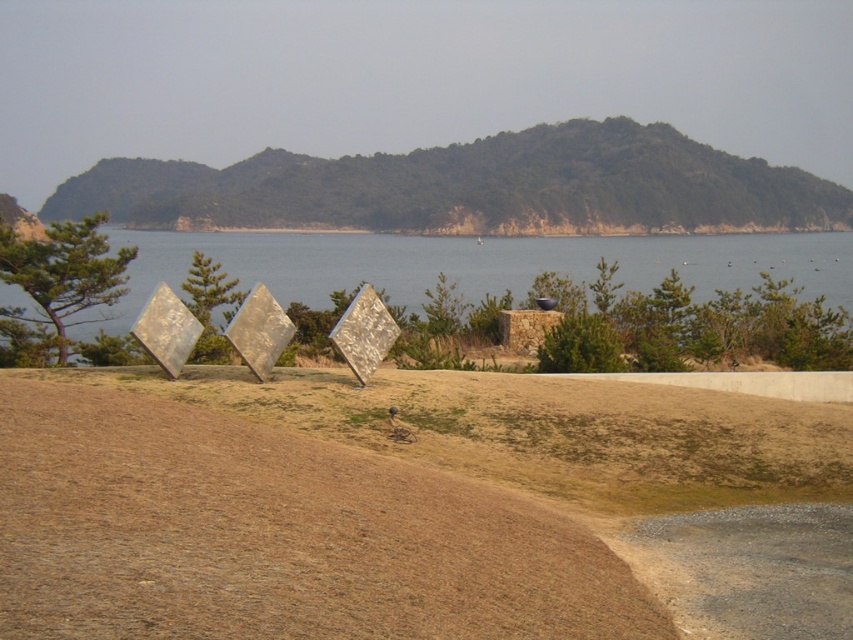
Question: Which point is farther from the camera taking this photo?

Choices:
 (A) (561, 179)
 (B) (311, 269)

Answer: (A)

Question: Which point is farther to the camera?

Choices:
 (A) green textured hillside at upper center
 (B) blue water at center

Answer: (A)

Question: Is green textured hillside at upper center bigger than blue water at center?

Choices:
 (A) yes
 (B) no

Answer: (B)

Question: Is green textured hillside at upper center closer to the viewer compared to blue water at center?

Choices:
 (A) yes
 (B) no

Answer: (B)

Question: Does green textured hillside at upper center lie behind blue water at center?

Choices:
 (A) no
 (B) yes

Answer: (B)